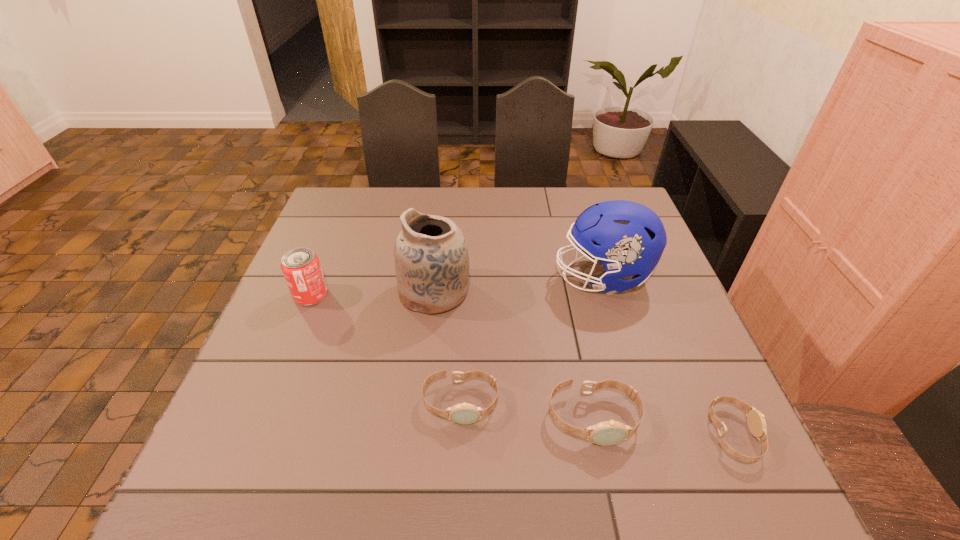
This screenshot has width=960, height=540. I want to click on vacant region that satisfies the following two spatial constraints: 1. on the back side of the can; 2. on the left side of the pottery, so click(x=312, y=292).